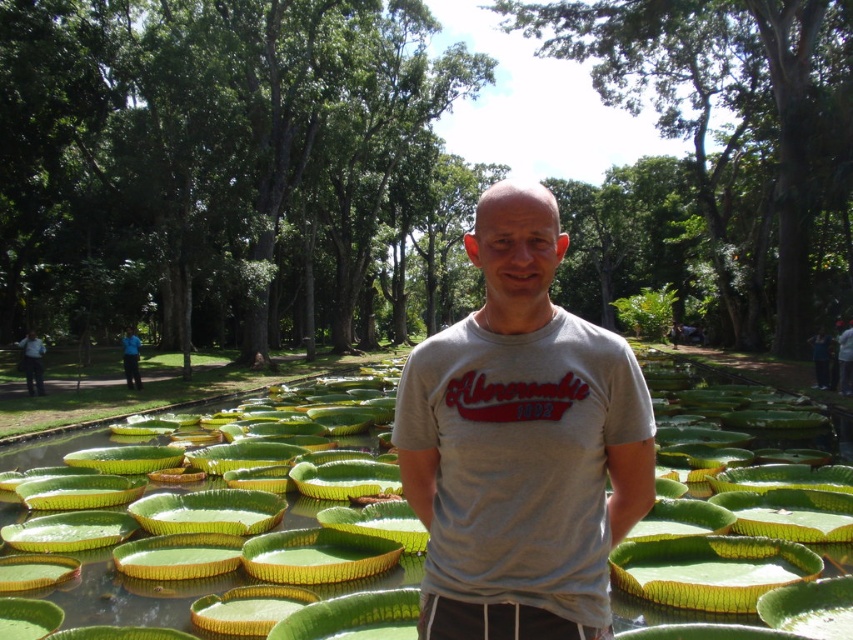
Can you confirm if green leafy lily pads at center is taller than green leafy plant at center?

Incorrect, green leafy lily pads at center's height is not larger of green leafy plant at center's.

Locate an element on the screen. green leafy lily pads at center is located at coordinates (229, 522).

Consider the image. Is gray cotton t-shirt at center smaller than blue shirt at center?

Indeed, gray cotton t-shirt at center has a smaller size compared to blue shirt at center.

Locate an element on the screen. This screenshot has width=853, height=640. gray cotton t-shirt at center is located at coordinates (521, 444).

Who is positioned more to the left, green leafy lily pads at center or gray cotton t-shirt at center?

gray cotton t-shirt at center is more to the left.

Between green leafy lily pads at center and gray cotton t-shirt at center, which one has less height?

With less height is green leafy lily pads at center.

The height and width of the screenshot is (640, 853). Describe the element at coordinates (229, 522) in the screenshot. I see `green leafy lily pads at center` at that location.

Where is `green leafy lily pads at center`? The height and width of the screenshot is (640, 853). green leafy lily pads at center is located at coordinates (229, 522).